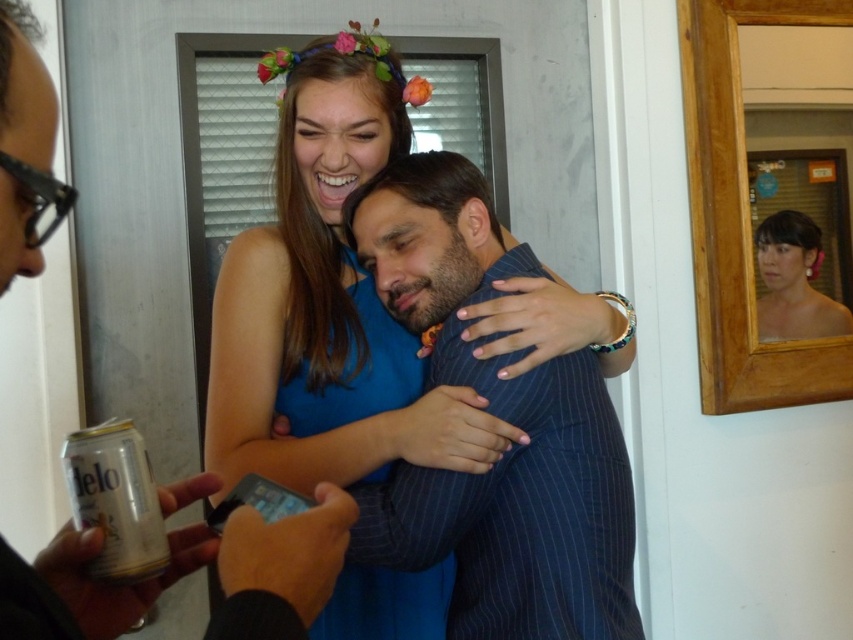
Question: Which of the following is the farthest from the observer?

Choices:
 (A) smooth skin face at upper right
 (B) blue pinstripe suit at center
 (C) blue striped suit at center

Answer: (A)

Question: Based on their relative distances, which object is nearer to the blue pinstripe suit at center?

Choices:
 (A) smooth skin face at upper right
 (B) blue striped suit at center

Answer: (B)

Question: From the image, what is the correct spatial relationship of blue striped suit at center in relation to blue pinstripe suit at center?

Choices:
 (A) right
 (B) left

Answer: (A)

Question: Which of the following is the farthest from the observer?

Choices:
 (A) blue striped suit at center
 (B) blue pinstripe suit at center
 (C) smooth skin face at upper right

Answer: (C)

Question: Is blue pinstripe suit at center positioned before smooth skin face at upper right?

Choices:
 (A) no
 (B) yes

Answer: (B)

Question: Does blue striped suit at center have a smaller size compared to smooth skin face at upper right?

Choices:
 (A) no
 (B) yes

Answer: (A)